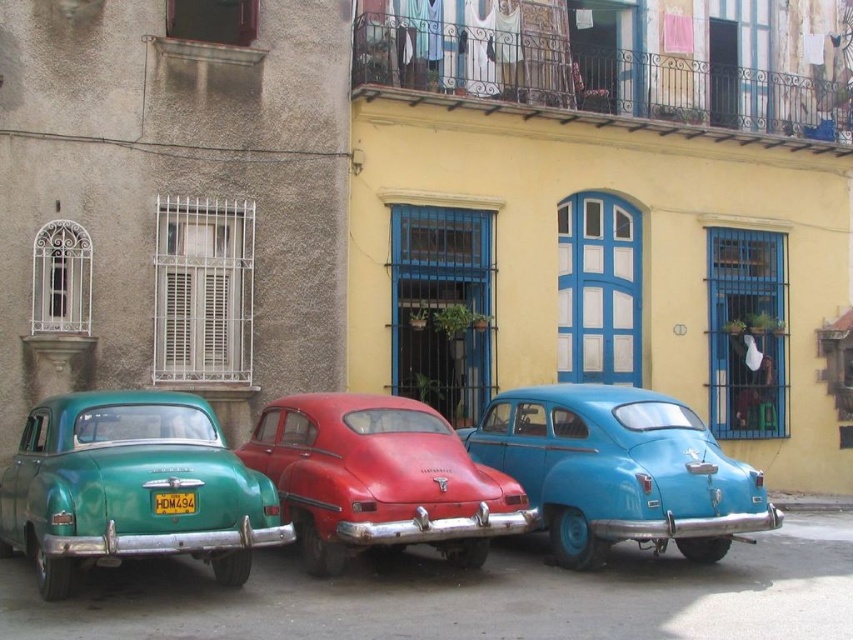
Can you confirm if rusty red car at center is positioned to the right of yellow matte license plate at center?

Indeed, rusty red car at center is positioned on the right side of yellow matte license plate at center.

Who is more distant from viewer, (x=463, y=556) or (x=164, y=497)?

The point (x=463, y=556) is behind.

This screenshot has height=640, width=853. Find the location of `rusty red car at center`. rusty red car at center is located at coordinates (379, 480).

Between matte blue car at center and yellow matte license plate at center, which one is positioned lower?

matte blue car at center is below.

Can you confirm if matte blue car at center is smaller than yellow matte license plate at center?

Actually, matte blue car at center might be larger than yellow matte license plate at center.

Identify the location of matte blue car at center. This screenshot has width=853, height=640. (619, 470).

Who is more distant from viewer, (67,426) or (426,500)?

Positioned behind is point (426,500).

From the picture: Is teal glossy sedan at left further to camera compared to rusty red car at center?

No.

Who is more distant from viewer, (103, 420) or (270, 468)?

The point (270, 468) is more distant.

The height and width of the screenshot is (640, 853). I want to click on teal glossy sedan at left, so click(131, 486).